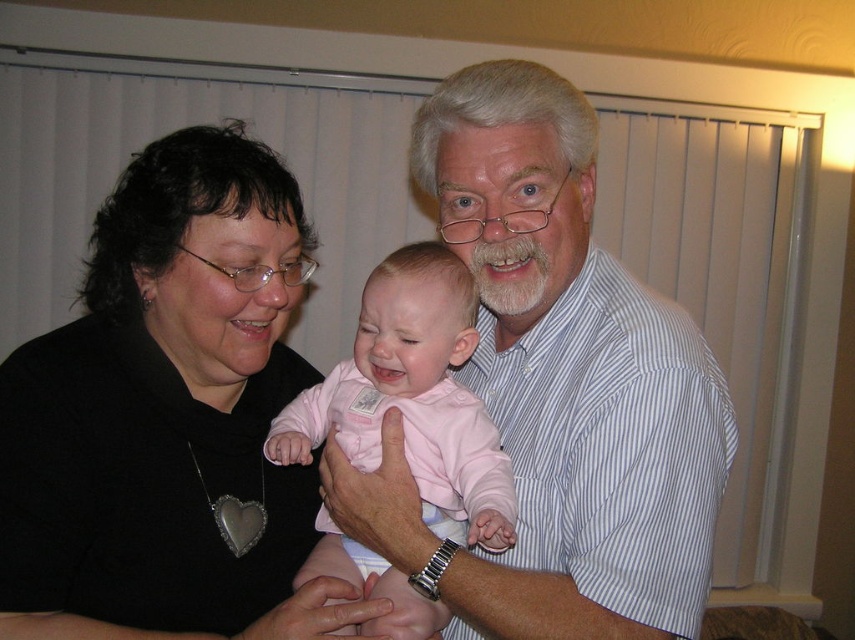
Can you confirm if white striped shirt at center is smaller than white striped shirt at upper right?

No.

Who is more distant from viewer, (469,88) or (661,580)?

Positioned behind is point (469,88).

Is point (699, 564) farther from viewer compared to point (553, 612)?

Yes.

The height and width of the screenshot is (640, 855). Find the location of `white striped shirt at center`. white striped shirt at center is located at coordinates (570, 378).

Can you confirm if white striped shirt at center is wider than pink fabric baby at center?

Indeed, white striped shirt at center has a greater width compared to pink fabric baby at center.

Looking at this image, does white striped shirt at center have a lesser height compared to pink fabric baby at center?

No.

Does point (535, 198) lie behind point (452, 500)?

No, it is not.

You are a GUI agent. You are given a task and a screenshot of the screen. Output one action in this format:
    pyautogui.click(x=<x>, y=<y>)
    Task: Click on the white striped shirt at center
    The image size is (855, 640).
    Given the screenshot: What is the action you would take?
    pyautogui.click(x=570, y=378)

Who is positioned more to the left, black fabric at center or pink fabric baby at center?

From the viewer's perspective, black fabric at center appears more on the left side.

Does black fabric at center have a greater width compared to pink fabric baby at center?

Yes, black fabric at center is wider than pink fabric baby at center.

Identify the location of black fabric at center. (x=168, y=417).